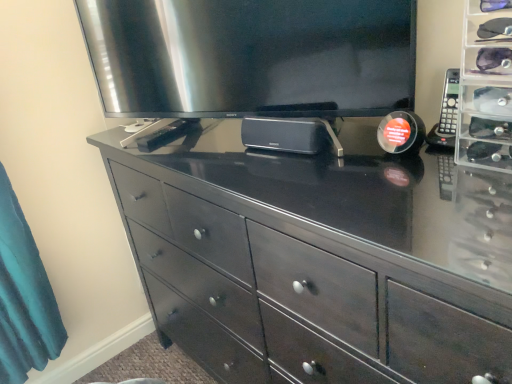
Question: Is point (187, 292) positioned closer to the camera than point (456, 107)?

Choices:
 (A) closer
 (B) farther

Answer: (B)

Question: Is dark wood dresser at center to the left or to the right of black plastic remote at right in the image?

Choices:
 (A) left
 (B) right

Answer: (A)

Question: Estimate the real-world distances between objects in this image. Which object is closer to the dark wood dresser at center?

Choices:
 (A) satin silver television at upper center
 (B) black plastic remote at right

Answer: (A)

Question: Which object is the closest to the black plastic remote at right?

Choices:
 (A) dark wood dresser at center
 (B) satin silver television at upper center

Answer: (B)